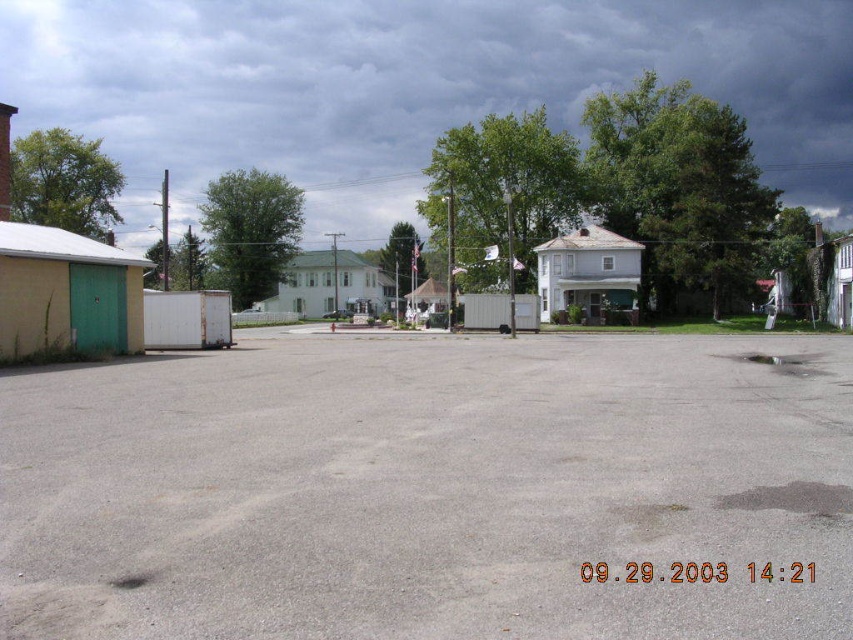
Is gray concrete parking lot at center above dark cloudy sky at upper center?

No.

Is point (399, 408) positioned before point (848, 163)?

That is True.

Identify the location of gray concrete parking lot at center. (428, 490).